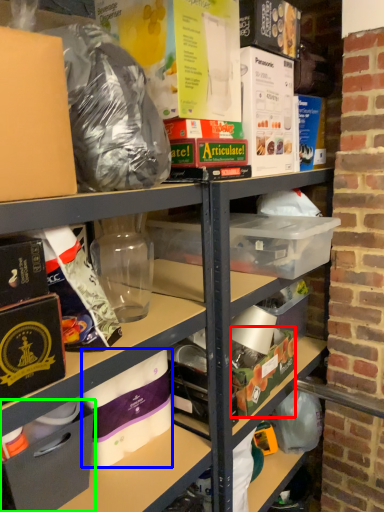
Question: Estimate the real-world distances between objects in this image. Which object is farther from box (highlighted by a red box), toilet paper (highlighted by a blue box) or box (highlighted by a green box)?

Choices:
 (A) toilet paper
 (B) box

Answer: (B)